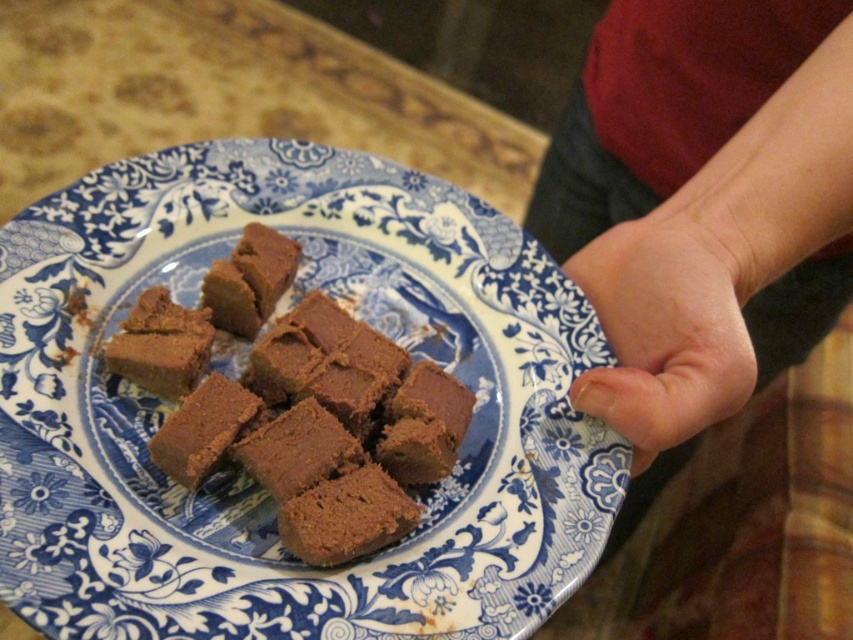
Question: Is brown matte fudge at center to the right of smooth skin at center from the viewer's perspective?

Choices:
 (A) no
 (B) yes

Answer: (A)

Question: Which point is closer to the camera?

Choices:
 (A) brown matte fudge at center
 (B) smooth skin at center

Answer: (A)

Question: Among these points, which one is farthest from the camera?

Choices:
 (A) (70, 314)
 (B) (840, 209)
 (C) (683, 268)
 (D) (256, 372)

Answer: (A)

Question: Which point is closer to the camera taking this photo?

Choices:
 (A) (619, 365)
 (B) (306, 413)
 (C) (573, 227)

Answer: (B)

Question: Is blue glazed plate at center below smooth skin at center?

Choices:
 (A) no
 (B) yes

Answer: (B)

Question: Can you confirm if blue glazed plate at center is bigger than smooth skin at center?

Choices:
 (A) yes
 (B) no

Answer: (A)